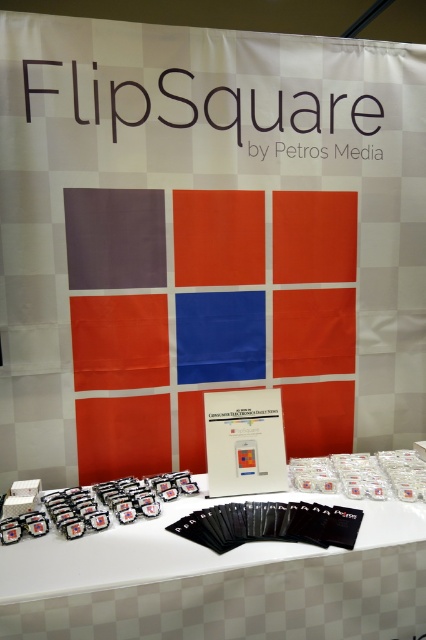
You are at a trade show and want to pick up the taller item between the white matte cards at center and the matte plastic cards at lower left. Which one should you choose?

The white matte cards at center is much taller than the matte plastic cards at lower left, so you should choose the white matte cards at center.

Looking at this image, you are organizing a product launch event and need to place a decorative vase between the white matte cards at center and the matte plastic cards at lower left. According to the scene description, where should you place the vase to ensure it is between these two items?

The white matte cards at center is positioned on the right side of the matte plastic cards at lower left, so the vase should be placed between them, to the right of the matte plastic cards at lower left and to the left of the white matte cards at center.